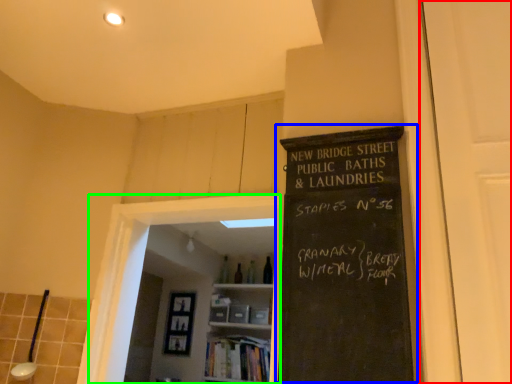
Question: Based on their relative distances, which object is nearer to glass door (highlighted by a red box)? Choose from bulletin board (highlighted by a blue box) and glass door (highlighted by a green box).

Choices:
 (A) bulletin board
 (B) glass door

Answer: (A)